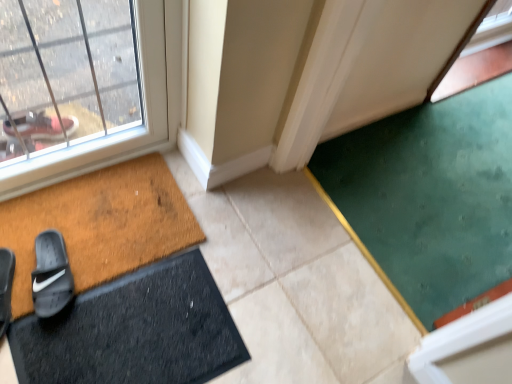
This screenshot has height=384, width=512. In order to click on free space that is to the left of black rubber slide at lower left, positioned as the first footwear in right-to-left order in this screenshot , I will do `click(14, 248)`.